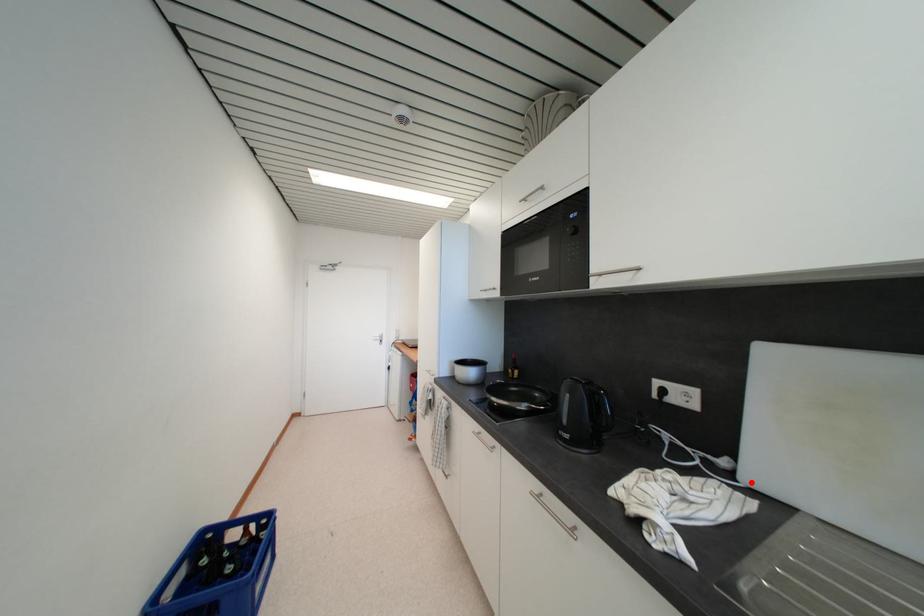
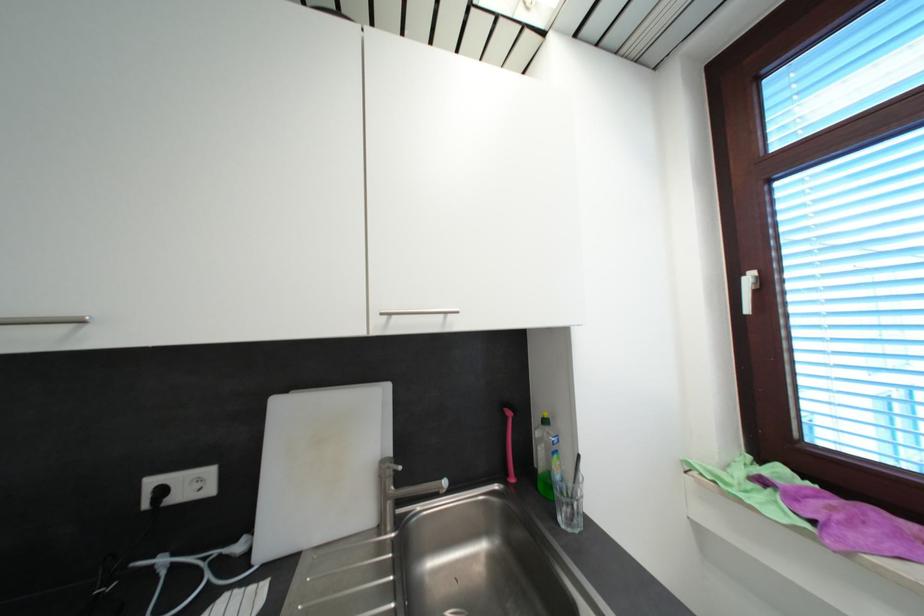
In the second image, find the point that corresponds to the highlighted location in the first image.

(265, 559)